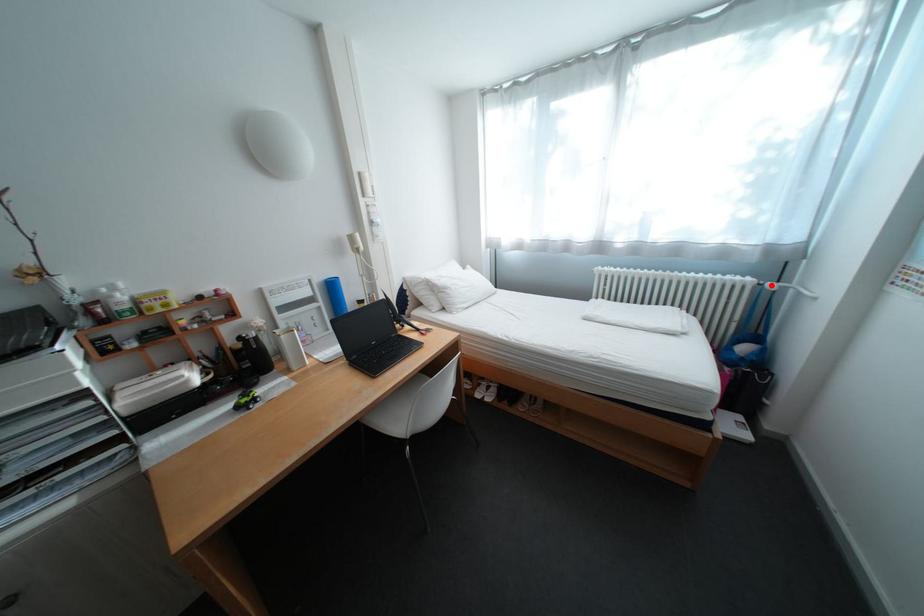
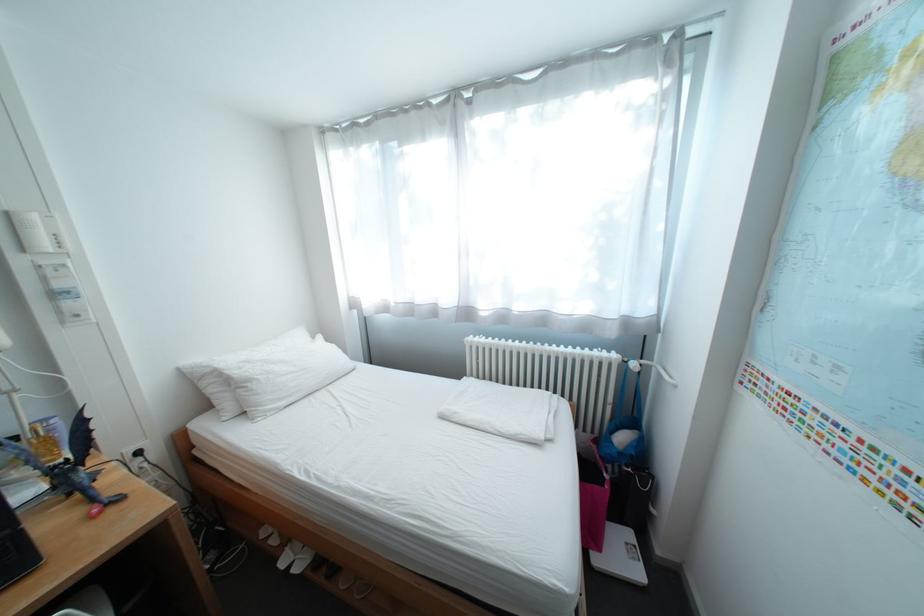
Where in the second image is the point corresponding to the highlighted location from the first image?

(637, 362)